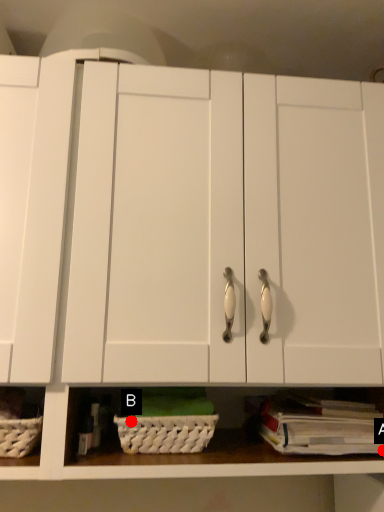
Question: Two points are circled on the image, labeled by A and B beside each circle. Which point is closer to the camera taking this photo?

Choices:
 (A) A is closer
 (B) B is closer

Answer: (A)